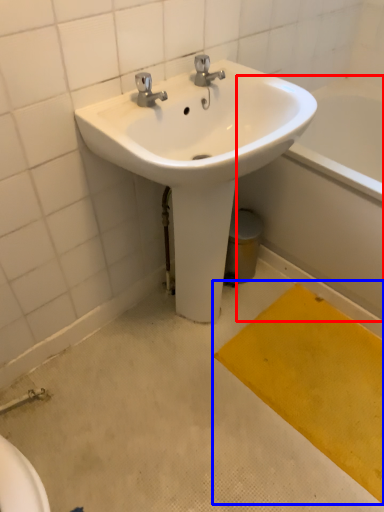
Question: Which object appears closest to the camera in this image, bath (highlighted by a red box) or doormat (highlighted by a blue box)?

Choices:
 (A) bath
 (B) doormat

Answer: (B)